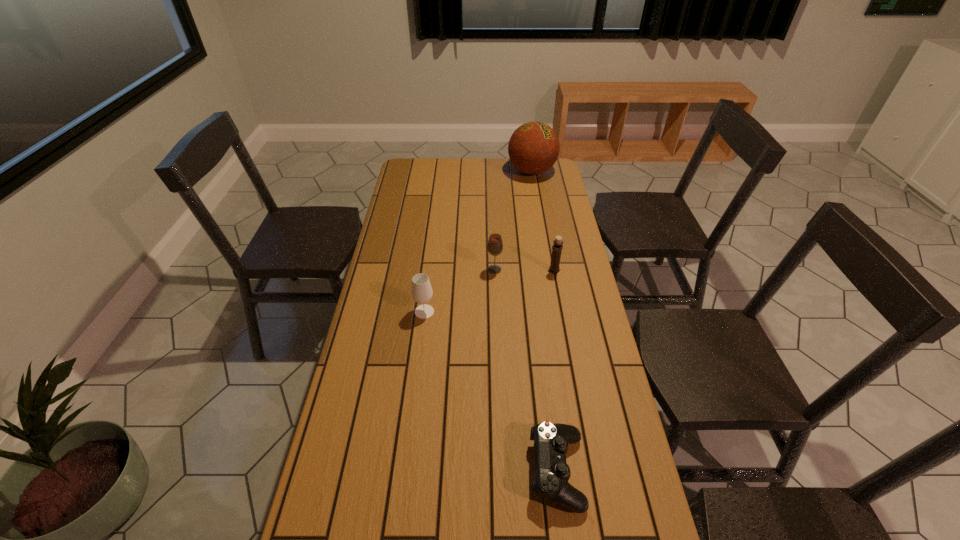
You are a GUI agent. You are given a task and a screenshot of the screen. Output one action in this format:
    pyautogui.click(x=<x>, y=<y>)
    Task: Click on the vacant space at the far edge of the desktop
    The width and height of the screenshot is (960, 540).
    Given the screenshot: What is the action you would take?
    pyautogui.click(x=436, y=173)

I want to click on free space at the left edge of the desktop, so click(x=355, y=383).

Where is `vacant point at the right edge`? vacant point at the right edge is located at coordinates (566, 278).

You are a GUI agent. You are given a task and a screenshot of the screen. Output one action in this format:
    pyautogui.click(x=<x>, y=<y>)
    Task: Click on the free space between the tallest object and the farther glass
    The height and width of the screenshot is (540, 960).
    Given the screenshot: What is the action you would take?
    tap(513, 221)

At what (x,y) coordinates should I click in order to perform the action: click on unoccupied area between the candle holder and the farther glass. Please return your answer as a coordinate pair (x, y). Looking at the image, I should click on (524, 271).

This screenshot has width=960, height=540. In order to click on blank region between the second nearest object and the tallest object in this screenshot , I will do `click(478, 241)`.

The height and width of the screenshot is (540, 960). In order to click on vacant space that's between the shortest object and the candle holder in this screenshot , I will do `click(555, 371)`.

Identify the location of vacant region between the candle holder and the second nearest object. This screenshot has height=540, width=960. (490, 291).

Find the location of a particular element. This screenshot has height=540, width=960. vacant space that is in between the nearest object and the candle holder is located at coordinates (555, 371).

Identify the location of free space between the candle holder and the nearest object. (555, 371).